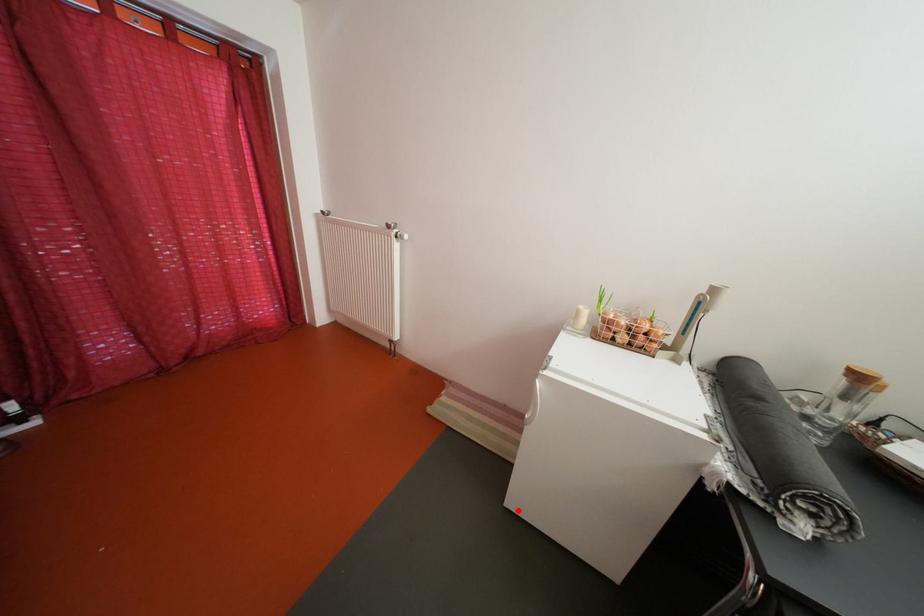
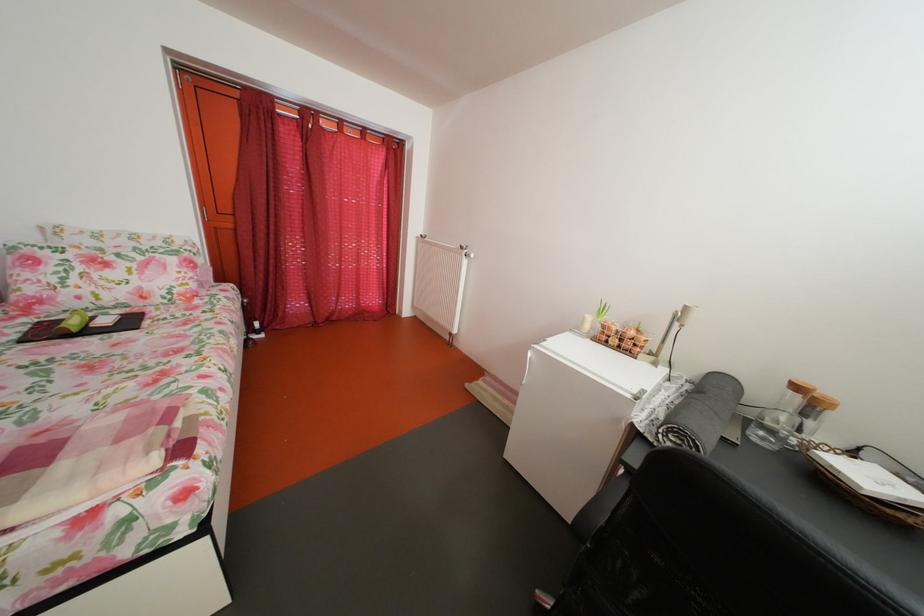
Question: I am providing you with two images of the same scene from different viewpoints. Image1 has a red point marked. In image2, the corresponding 3D location appears at what relative position? Reply with the corresponding letter.

Choices:
 (A) Closer
 (B) Farther

Answer: (A)